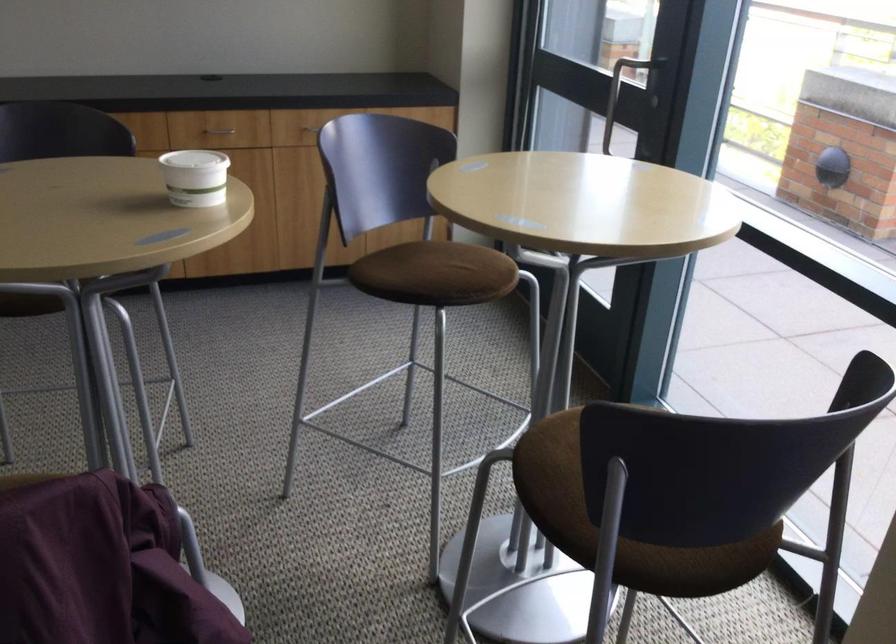
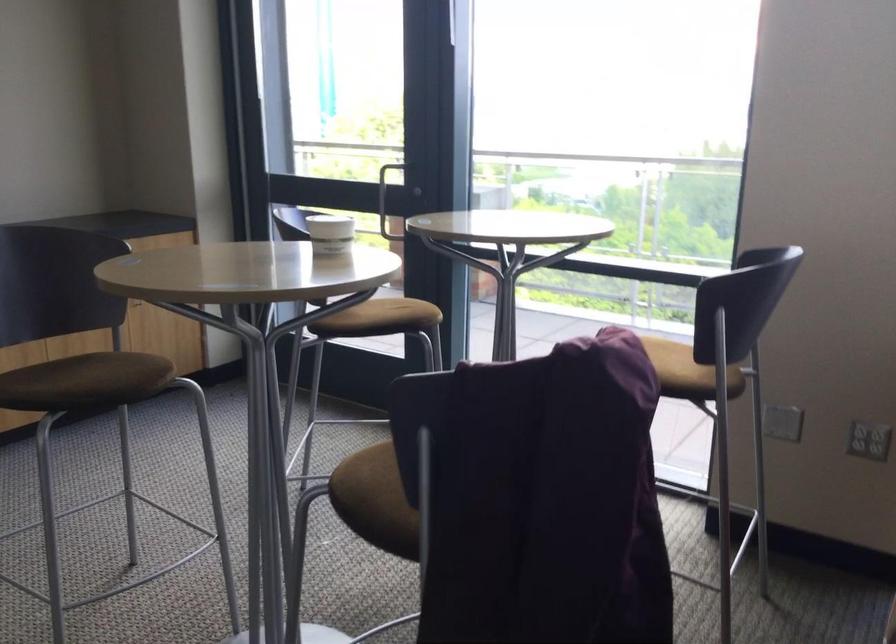
In the second image, find the point that corresponds to point (283, 204) in the first image.

(76, 344)